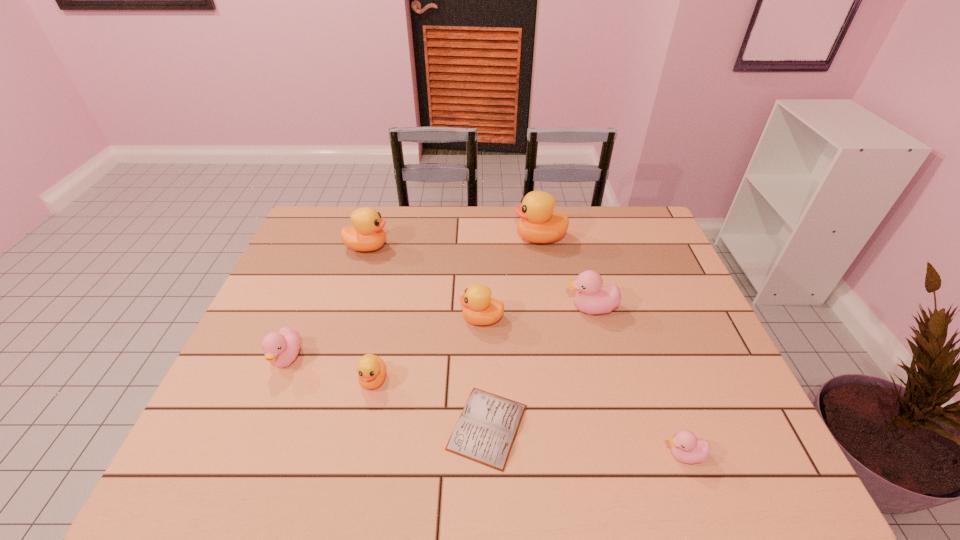
What are the coordinates of `free space located on the back of the diary` in the screenshot? It's located at (487, 357).

At what (x,y) coordinates should I click in order to perform the action: click on duckling that is at the near edge. Please return your answer as a coordinate pair (x, y). The height and width of the screenshot is (540, 960). Looking at the image, I should click on (685, 446).

Locate an element on the screen. The width and height of the screenshot is (960, 540). diary that is at the near edge is located at coordinates (486, 430).

Where is `object that is at the left edge`? The width and height of the screenshot is (960, 540). object that is at the left edge is located at coordinates (281, 348).

Locate an element on the screen. object located in the right edge section of the desktop is located at coordinates click(x=685, y=446).

Identify the location of object at the near right corner. (685, 446).

In the image, there is a desktop. Where is `vacant space at the far edge`? This screenshot has width=960, height=540. vacant space at the far edge is located at coordinates (508, 218).

The width and height of the screenshot is (960, 540). In the image, there is a desktop. In order to click on free space at the near edge in this screenshot , I will do `click(270, 465)`.

Where is `vacant space at the left edge of the desktop`? vacant space at the left edge of the desktop is located at coordinates (314, 284).

You are a GUI agent. You are given a task and a screenshot of the screen. Output one action in this format:
    pyautogui.click(x=<x>, y=<y>)
    Task: Click on the vacant space at the right edge
    
    Given the screenshot: What is the action you would take?
    pyautogui.click(x=705, y=325)